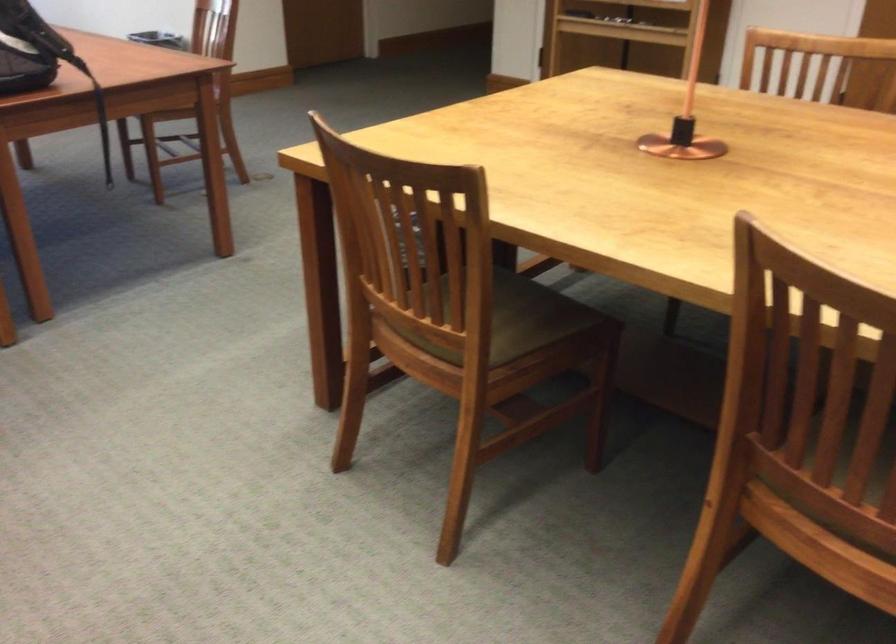
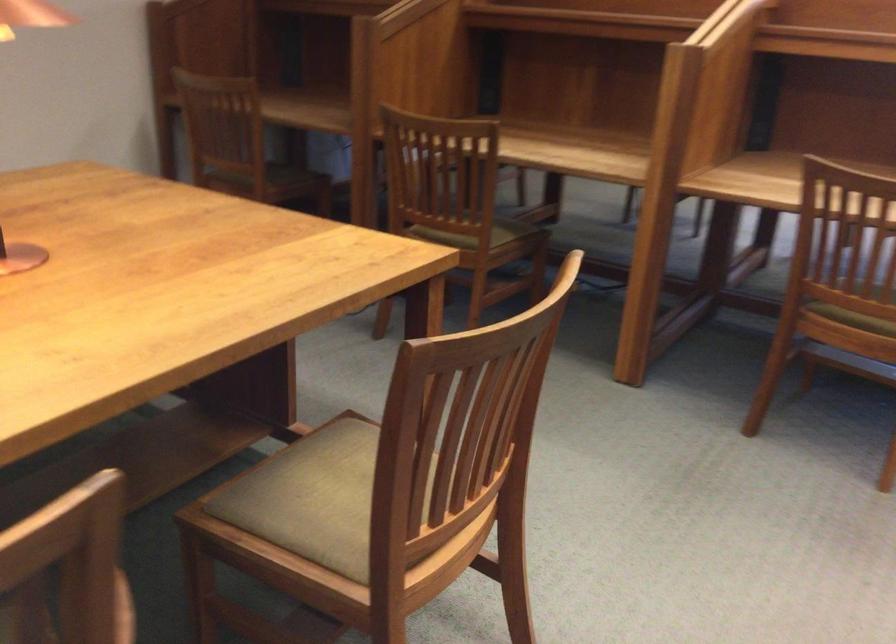
Question: The camera is either moving clockwise (left) or counter-clockwise (right) around the object. The first image is from the beginning of the video and the second image is from the end. Is the camera moving left or right when shooting the video?

Choices:
 (A) Left
 (B) Right

Answer: (B)